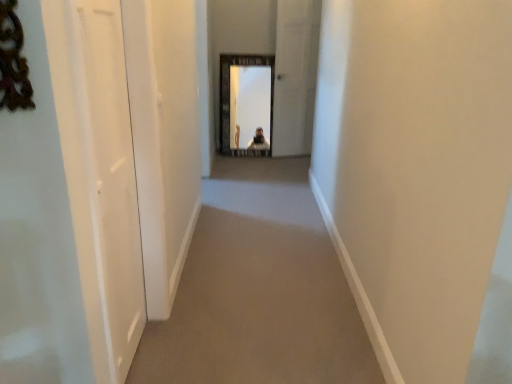
Question: Should I look upward or downward to see beige carpet at center?

Choices:
 (A) up
 (B) down

Answer: (B)

Question: Is white glossy door at left, the 1th screen door when ordered from bottom to top, inside beige carpet at center?

Choices:
 (A) no
 (B) yes

Answer: (A)

Question: Is beige carpet at center aimed at white glossy door at left, acting as the 1th screen door starting from the front?

Choices:
 (A) yes
 (B) no

Answer: (B)

Question: Is beige carpet at center shorter than white glossy door at left, which ranks as the 2th screen door in top-to-bottom order?

Choices:
 (A) yes
 (B) no

Answer: (A)

Question: Can you confirm if beige carpet at center is bigger than white glossy door at left, placed as the 2th screen door when sorted from right to left?

Choices:
 (A) no
 (B) yes

Answer: (B)

Question: Is there a large distance between beige carpet at center and white glossy door at left, acting as the first screen door starting from the left?

Choices:
 (A) no
 (B) yes

Answer: (A)

Question: From a real-world perspective, is beige carpet at center physically below white glossy door at left, acting as the first screen door starting from the left?

Choices:
 (A) no
 (B) yes

Answer: (B)

Question: Is the depth of beige carpet at center less than that of white glossy door at center, the second screen door in the bottom-to-top sequence?

Choices:
 (A) no
 (B) yes

Answer: (B)

Question: From a real-world perspective, is beige carpet at center located higher than white glossy door at center, the first screen door viewed from the back?

Choices:
 (A) yes
 (B) no

Answer: (B)

Question: From the image's perspective, is beige carpet at center under white glossy door at center, the 2th screen door viewed from the front?

Choices:
 (A) no
 (B) yes

Answer: (B)

Question: From a real-world perspective, is beige carpet at center located beneath white glossy door at center, the first screen door viewed from the back?

Choices:
 (A) no
 (B) yes

Answer: (B)

Question: Is beige carpet at center oriented towards white glossy door at center, which is counted as the 2th screen door, starting from the left?

Choices:
 (A) no
 (B) yes

Answer: (A)

Question: Can you confirm if beige carpet at center is shorter than white glossy door at center, acting as the 1th screen door starting from the right?

Choices:
 (A) no
 (B) yes

Answer: (B)

Question: Can you confirm if white glossy door at left, acting as the 1th screen door starting from the front, is bigger than white glossy door at center, the first screen door viewed from the back?

Choices:
 (A) no
 (B) yes

Answer: (A)